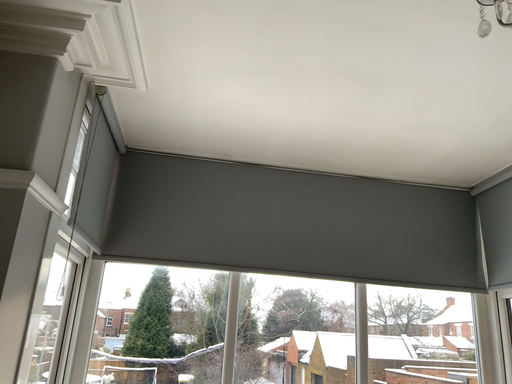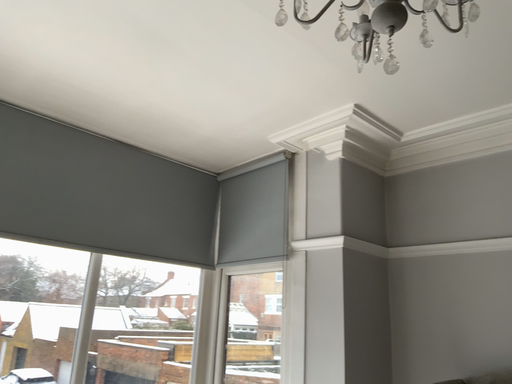
Question: Which way did the camera rotate in the video?

Choices:
 (A) rotated upward
 (B) rotated downward

Answer: (B)